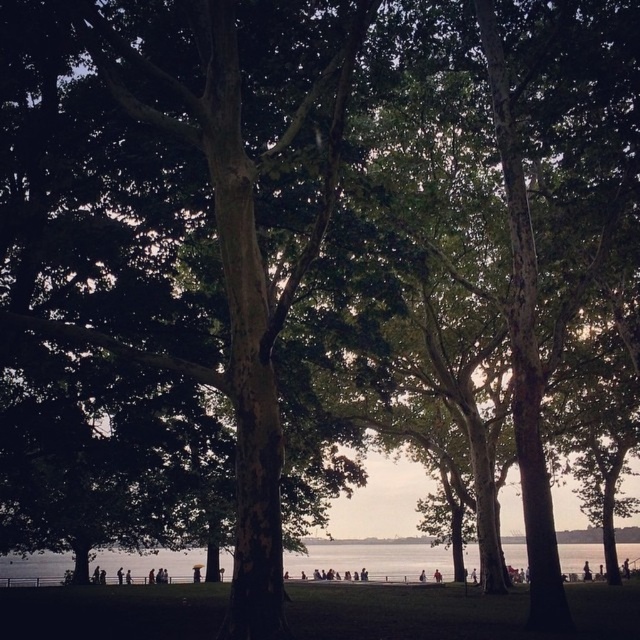
You are standing in the park and see the clear water at lower center. If you want to reach it, which direction should you move relative to your current position?

The clear water at lower center is located at point (372, 560), so you should move forward and slightly to the right to reach it.

You are a photographer trying to capture the clear water at lower center and the light brown wooden stick at center in the same frame. Based on their positions, which object will appear taller in the photo?

The clear water at lower center appears taller than the light brown wooden stick at center in the photo because it has a greater height compared to it.